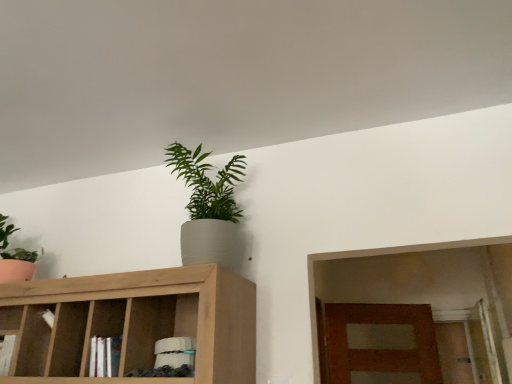
The image size is (512, 384). What do you see at coordinates (14, 256) in the screenshot?
I see `matte green plant at left, the first houseplant when ordered from left to right` at bounding box center [14, 256].

Describe the element at coordinates (208, 206) in the screenshot. I see `green matte plant at upper center, which is counted as the first houseplant, starting from the right` at that location.

Identify the location of light brown wood cabinet at upper center. (133, 323).

Which of these two, light brown wood cabinet at upper center or green matte plant at upper center, which appears as the second houseplant when viewed from the left, is wider?

light brown wood cabinet at upper center.

Considering the relative sizes of light brown wood cabinet at upper center and green matte plant at upper center, which appears as the second houseplant when viewed from the left, in the image provided, is light brown wood cabinet at upper center shorter than green matte plant at upper center, which appears as the second houseplant when viewed from the left,?

Indeed, light brown wood cabinet at upper center has a lesser height compared to green matte plant at upper center, which appears as the second houseplant when viewed from the left.

Does light brown wood cabinet at upper center appear on the left side of green matte plant at upper center, which is counted as the first houseplant, starting from the right?

Yes, light brown wood cabinet at upper center is to the left of green matte plant at upper center, which is counted as the first houseplant, starting from the right.

From the image's perspective, does green matte plant at upper center, which appears as the second houseplant when viewed from the left, appear higher than matte green plant at left, which is counted as the second houseplant, starting from the right?

Correct, green matte plant at upper center, which appears as the second houseplant when viewed from the left, appears higher than matte green plant at left, which is counted as the second houseplant, starting from the right, in the image.

Is green matte plant at upper center, which is counted as the first houseplant, starting from the right, oriented towards matte green plant at left, which is counted as the second houseplant, starting from the right?

No.

Considering the sizes of objects green matte plant at upper center, which appears as the second houseplant when viewed from the left, and matte green plant at left, the first houseplant when ordered from left to right, in the image provided, who is shorter, green matte plant at upper center, which appears as the second houseplant when viewed from the left, or matte green plant at left, the first houseplant when ordered from left to right,?

Standing shorter between the two is matte green plant at left, the first houseplant when ordered from left to right.

From a real-world perspective, which is physically below, green matte plant at upper center, which appears as the second houseplant when viewed from the left, or matte green plant at left, the first houseplant when ordered from left to right?

From a 3D spatial view, green matte plant at upper center, which appears as the second houseplant when viewed from the left, is below.

Is matte green plant at left, which is counted as the second houseplant, starting from the right, positioned before green matte plant at upper center, which appears as the second houseplant when viewed from the left?

No, matte green plant at left, which is counted as the second houseplant, starting from the right, is further to the viewer.

In the scene shown: Is matte green plant at left, the first houseplant when ordered from left to right, oriented towards green matte plant at upper center, which is counted as the first houseplant, starting from the right?

No.

Is matte green plant at left, which is counted as the second houseplant, starting from the right, taller or shorter than green matte plant at upper center, which appears as the second houseplant when viewed from the left?

Considering their sizes, matte green plant at left, which is counted as the second houseplant, starting from the right, has less height than green matte plant at upper center, which appears as the second houseplant when viewed from the left.

Would you say matte green plant at left, which is counted as the second houseplant, starting from the right, is outside green matte plant at upper center, which is counted as the first houseplant, starting from the right?

Yes, matte green plant at left, which is counted as the second houseplant, starting from the right, is outside of green matte plant at upper center, which is counted as the first houseplant, starting from the right.

What's the angular difference between matte green plant at left, the first houseplant when ordered from left to right, and light brown wood cabinet at upper center's facing directions?

They differ by 2.13 degrees in their facing directions.

Between matte green plant at left, which is counted as the second houseplant, starting from the right, and light brown wood cabinet at upper center, which one appears on the left side from the viewer's perspective?

From the viewer's perspective, matte green plant at left, which is counted as the second houseplant, starting from the right, appears more on the left side.

Is matte green plant at left, which is counted as the second houseplant, starting from the right, far from light brown wood cabinet at upper center?

They are positioned close to each other.

Find the location of a particular element. This screenshot has height=384, width=512. the 1st houseplant above the light brown wood cabinet at upper center (from the image's perspective) is located at coordinates (14, 256).

Is light brown wood cabinet at upper center placed right next to matte green plant at left, the first houseplant when ordered from left to right?

They are not placed beside each other.

Does point (123, 283) appear closer or farther from the camera than point (2, 228)?

Point (123, 283).

Can you confirm if light brown wood cabinet at upper center is smaller than matte green plant at left, which is counted as the second houseplant, starting from the right?

No.

Who is taller, light brown wood cabinet at upper center or matte green plant at left, the first houseplant when ordered from left to right?

light brown wood cabinet at upper center.

From the image's perspective, count 2nd houseplants upward from the light brown wood cabinet at upper center and point to it. Please provide its 2D coordinates.

[(208, 206)]

Which of these two, green matte plant at upper center, which is counted as the first houseplant, starting from the right, or light brown wood cabinet at upper center, stands shorter?

Result: With less height is light brown wood cabinet at upper center.

From a real-world perspective, which is physically below, green matte plant at upper center, which appears as the second houseplant when viewed from the left, or light brown wood cabinet at upper center?

From a 3D spatial view, light brown wood cabinet at upper center is below.

Looking at their sizes, would you say green matte plant at upper center, which is counted as the first houseplant, starting from the right, is wider or thinner than light brown wood cabinet at upper center?

green matte plant at upper center, which is counted as the first houseplant, starting from the right, is thinner than light brown wood cabinet at upper center.

This screenshot has height=384, width=512. What are the coordinates of `the 2nd houseplant above when counting from the light brown wood cabinet at upper center (from the image's perspective)` in the screenshot? It's located at coord(208,206).

Identify the location of houseplant that is behind the green matte plant at upper center, which appears as the second houseplant when viewed from the left. The width and height of the screenshot is (512, 384). (14, 256).

Based on their spatial positions, is matte green plant at left, which is counted as the second houseplant, starting from the right, or light brown wood cabinet at upper center closer to green matte plant at upper center, which is counted as the first houseplant, starting from the right?

light brown wood cabinet at upper center.

Looking at the image, which one is located closer to green matte plant at upper center, which appears as the second houseplant when viewed from the left, light brown wood cabinet at upper center or matte green plant at left, which is counted as the second houseplant, starting from the right?

light brown wood cabinet at upper center lies closer to green matte plant at upper center, which appears as the second houseplant when viewed from the left, than the other object.

When comparing their distances from light brown wood cabinet at upper center, does matte green plant at left, the first houseplant when ordered from left to right, or green matte plant at upper center, which appears as the second houseplant when viewed from the left, seem closer?

The object closer to light brown wood cabinet at upper center is green matte plant at upper center, which appears as the second houseplant when viewed from the left.

Looking at the image, which one is located further to light brown wood cabinet at upper center, green matte plant at upper center, which appears as the second houseplant when viewed from the left, or matte green plant at left, which is counted as the second houseplant, starting from the right?

Based on the image, matte green plant at left, which is counted as the second houseplant, starting from the right, appears to be further to light brown wood cabinet at upper center.

Based on their spatial positions, is green matte plant at upper center, which appears as the second houseplant when viewed from the left, or light brown wood cabinet at upper center closer to matte green plant at left, which is counted as the second houseplant, starting from the right?

Based on the image, light brown wood cabinet at upper center appears to be nearer to matte green plant at left, which is counted as the second houseplant, starting from the right.

Estimate the real-world distances between objects in this image. Which object is closer to matte green plant at left, the first houseplant when ordered from left to right, light brown wood cabinet at upper center or green matte plant at upper center, which appears as the second houseplant when viewed from the left?

The object closer to matte green plant at left, the first houseplant when ordered from left to right, is light brown wood cabinet at upper center.

Find the location of `cabinetry between matte green plant at left, the first houseplant when ordered from left to right, and green matte plant at upper center, which appears as the second houseplant when viewed from the left, from left to right`. cabinetry between matte green plant at left, the first houseplant when ordered from left to right, and green matte plant at upper center, which appears as the second houseplant when viewed from the left, from left to right is located at coordinates (133, 323).